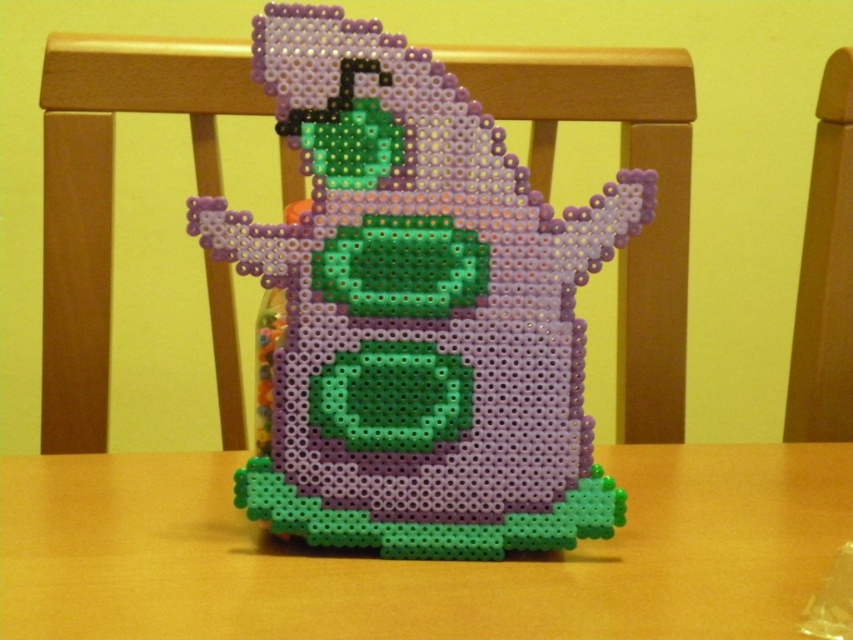
You are an artist planning to place a larger sculpture next to the perler bead ghost at center and the wooden table at center. Which object should you place the sculpture next to to ensure it doesn

The perler bead ghost at center is smaller than the wooden table at center, so you should place the larger sculpture next to the wooden table at center to maintain proportion and balance.

You are sitting on the wooden chair at right and want to reach for the ghostly figure on the wooden table at center. Is the table within easy reach from your current position?

The wooden table at center is below the wooden chair at right, so the table is positioned lower than the chair. Since you are sitting on the wooden chair at right, you can easily reach the table as it is directly beneath you.